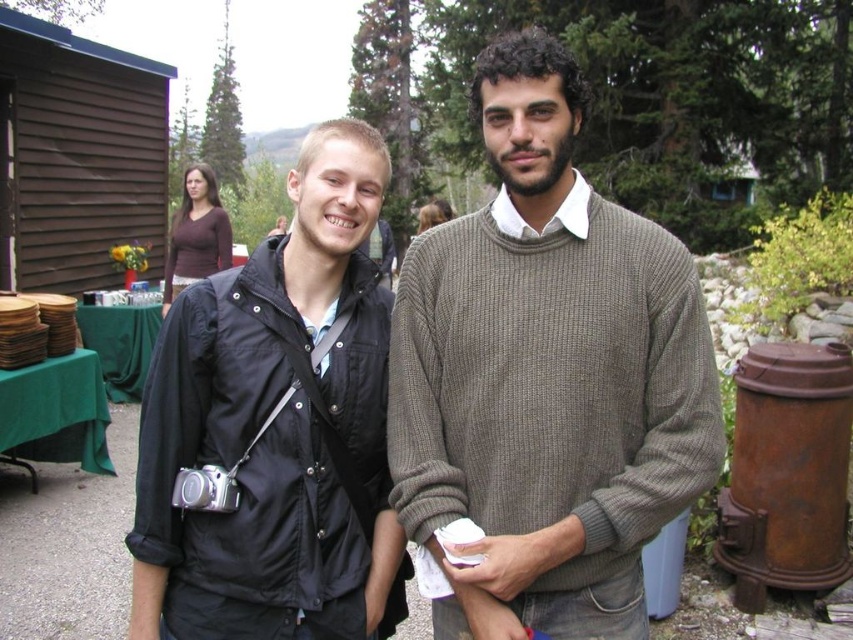
Question: Does knit brown sweater at center appear on the right side of black matte jacket at left?

Choices:
 (A) yes
 (B) no

Answer: (A)

Question: Among these points, which one is farthest from the camera?

Choices:
 (A) (206, 179)
 (B) (379, 413)
 (C) (692, 376)

Answer: (A)

Question: Which object is positioned closest to the black matte jacket at left?

Choices:
 (A) brown matte shirt at upper left
 (B) knit brown sweater at center

Answer: (B)

Question: From the image, what is the correct spatial relationship of knit brown sweater at center in relation to black matte jacket at left?

Choices:
 (A) right
 (B) left

Answer: (A)

Question: Does knit brown sweater at center have a larger size compared to black matte jacket at left?

Choices:
 (A) no
 (B) yes

Answer: (B)

Question: Which object appears farthest from the camera in this image?

Choices:
 (A) black matte jacket at left
 (B) brown matte shirt at upper left
 (C) knit brown sweater at center

Answer: (B)